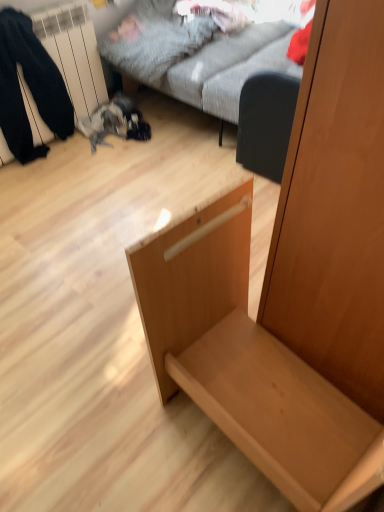
This screenshot has height=512, width=384. What are the coordinates of `black matte swivel chair at center-right` in the screenshot? It's located at (266, 122).

At what (x,y) coordinates should I click in order to perform the action: click on black fabric pants at left. Please return your answer as a coordinate pair (x, y). Image resolution: width=384 pixels, height=512 pixels. Looking at the image, I should click on (29, 87).

The height and width of the screenshot is (512, 384). In order to click on light wood drawer at center in this screenshot , I will do `click(290, 285)`.

Is point (374, 13) positioned after point (45, 50)?

No, (374, 13) is closer to viewer.

From a real-world perspective, between light wood drawer at center and black fabric pants at left, who is vertically lower?

From a 3D spatial view, black fabric pants at left is below.

Consider the image. Would you say light wood drawer at center is outside black fabric pants at left?

Absolutely, light wood drawer at center is external to black fabric pants at left.

Can you confirm if textured gray fabric couch at upper center is wider than black fabric pants at left?

Correct, the width of textured gray fabric couch at upper center exceeds that of black fabric pants at left.

Is textured gray fabric couch at upper center placed right next to black fabric pants at left?

textured gray fabric couch at upper center is not next to black fabric pants at left, and they're not touching.

From a real-world perspective, which is physically above, textured gray fabric couch at upper center or black fabric pants at left?

In real-world perspective, black fabric pants at left is above.

Considering the relative sizes of textured gray fabric couch at upper center and black fabric pants at left in the image provided, is textured gray fabric couch at upper center taller than black fabric pants at left?

In fact, textured gray fabric couch at upper center may be shorter than black fabric pants at left.

What's the angular difference between black matte swivel chair at center-right and light wood drawer at center's facing directions?

black matte swivel chair at center-right and light wood drawer at center are facing 8.03 degrees away from each other.

Are black matte swivel chair at center-right and light wood drawer at center making contact?

No, black matte swivel chair at center-right is not making contact with light wood drawer at center.

Locate an element on the screen. The height and width of the screenshot is (512, 384). swivel chair directly beneath the light wood drawer at center (from a real-world perspective) is located at coordinates (266, 122).

Is black matte swivel chair at center-right not inside light wood drawer at center?

That's correct, black matte swivel chair at center-right is outside of light wood drawer at center.

Visually, is light wood drawer at center positioned to the left or to the right of textured gray fabric couch at upper center?

light wood drawer at center is to the left of textured gray fabric couch at upper center.

Does light wood drawer at center have a greater height compared to textured gray fabric couch at upper center?

Correct, light wood drawer at center is much taller as textured gray fabric couch at upper center.

How different are the orientations of light wood drawer at center and textured gray fabric couch at upper center in degrees?

The angle between the facing direction of light wood drawer at center and the facing direction of textured gray fabric couch at upper center is 98 degrees.

Based on their sizes in the image, would you say light wood drawer at center is bigger or smaller than textured gray fabric couch at upper center?

In the image, light wood drawer at center appears to be smaller than textured gray fabric couch at upper center.

Considering the sizes of objects black fabric pants at left and textured gray fabric couch at upper center in the image provided, who is shorter, black fabric pants at left or textured gray fabric couch at upper center?

With less height is textured gray fabric couch at upper center.

Considering the relative positions of black fabric pants at left and textured gray fabric couch at upper center in the image provided, is black fabric pants at left in front of textured gray fabric couch at upper center?

No.

Between point (3, 122) and point (234, 92), which one is positioned in front?

The point (234, 92) is in front.

Which object is wider, black fabric pants at left or textured gray fabric couch at upper center?

Wider between the two is textured gray fabric couch at upper center.

Measure the distance from textured gray fabric couch at upper center to light wood drawer at center.

textured gray fabric couch at upper center and light wood drawer at center are 1.22 meters apart from each other.

Is textured gray fabric couch at upper center beside light wood drawer at center?

textured gray fabric couch at upper center and light wood drawer at center are clearly separated.

Based on the photo, is textured gray fabric couch at upper center positioned with its back to light wood drawer at center?

textured gray fabric couch at upper center is not turned away from light wood drawer at center.

From a real-world perspective, which object stands above the other?

light wood drawer at center is physically above.

Can you tell me how much black fabric pants at left and light wood drawer at center differ in facing direction?

95.9 degrees.

Considering the sizes of objects black fabric pants at left and light wood drawer at center in the image provided, who is smaller, black fabric pants at left or light wood drawer at center?

black fabric pants at left is smaller.

How much distance is there between black fabric pants at left and light wood drawer at center?

black fabric pants at left and light wood drawer at center are 1.61 meters apart.

Is black fabric pants at left located outside light wood drawer at center?

black fabric pants at left is positioned outside light wood drawer at center.

Where is `couple on the left of the light wood drawer at center`? This screenshot has width=384, height=512. couple on the left of the light wood drawer at center is located at coordinates (29, 87).

The image size is (384, 512). I want to click on studio couch directly beneath the black fabric pants at left (from a real-world perspective), so click(222, 66).

In the scene shown: Considering their positions, is textured gray fabric couch at upper center positioned further to light wood drawer at center than black fabric pants at left?

The object further to light wood drawer at center is black fabric pants at left.

Based on their spatial positions, is black matte swivel chair at center-right or light wood drawer at center closer to textured gray fabric couch at upper center?

black matte swivel chair at center-right is positioned closer to the anchor textured gray fabric couch at upper center.

Which object lies further to the anchor point light wood drawer at center, black fabric pants at left or black matte swivel chair at center-right?

Based on the image, black fabric pants at left appears to be further to light wood drawer at center.

In the scene shown: When comparing their distances from black matte swivel chair at center-right, does textured gray fabric couch at upper center or light wood drawer at center seem closer?

textured gray fabric couch at upper center is positioned closer to the anchor black matte swivel chair at center-right.

Estimate the real-world distances between objects in this image. Which object is further from light wood drawer at center, black matte swivel chair at center-right or black fabric pants at left?

black fabric pants at left is further to light wood drawer at center.

From the image, which object appears to be nearer to black matte swivel chair at center-right, black fabric pants at left or textured gray fabric couch at upper center?

Based on the image, textured gray fabric couch at upper center appears to be nearer to black matte swivel chair at center-right.

When comparing their distances from black matte swivel chair at center-right, does textured gray fabric couch at upper center or black fabric pants at left seem further?

black fabric pants at left lies further to black matte swivel chair at center-right than the other object.

From the image, which object appears to be nearer to light wood drawer at center, black matte swivel chair at center-right or textured gray fabric couch at upper center?

black matte swivel chair at center-right.

Image resolution: width=384 pixels, height=512 pixels. In order to click on furniture between black fabric pants at left and black matte swivel chair at center-right from left to right in this screenshot , I will do `click(290, 285)`.

Identify the location of couple between textured gray fabric couch at upper center and light wood drawer at center from top to bottom. Image resolution: width=384 pixels, height=512 pixels. (29, 87).

Where is `swivel chair between textured gray fabric couch at upper center and light wood drawer at center vertically`? swivel chair between textured gray fabric couch at upper center and light wood drawer at center vertically is located at coordinates (266, 122).

Locate an element on the screen. studio couch between black fabric pants at left and black matte swivel chair at center-right from left to right is located at coordinates (222, 66).